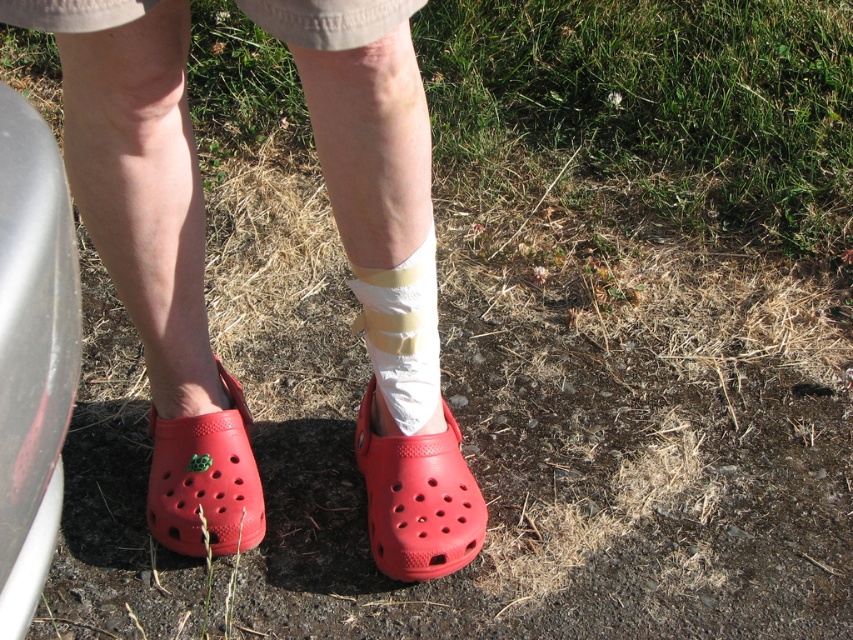
Question: Among these objects, which one is nearest to the camera?

Choices:
 (A) white/textured bandage at lower center
 (B) rubber/crocs at lower left

Answer: (A)

Question: Which object appears closest to the camera in this image?

Choices:
 (A) matte rubber clog at lower left
 (B) rubber/crocs at lower left

Answer: (A)

Question: Is rubber croc at center further to the viewer compared to white/textured bandage at lower center?

Choices:
 (A) yes
 (B) no

Answer: (A)

Question: Does rubber croc at center appear on the left side of rubber/crocs at lower left?

Choices:
 (A) yes
 (B) no

Answer: (B)

Question: Does rubber croc at center lie behind rubber/crocs at lower left?

Choices:
 (A) no
 (B) yes

Answer: (B)

Question: Which object is the closest to the white/textured bandage at lower center?

Choices:
 (A) rubber croc at center
 (B) rubber/crocs at lower left

Answer: (A)